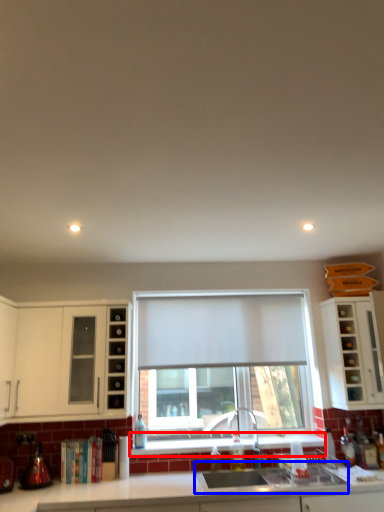
Question: Which point is further to the camera, window sill (highlighted by a red box) or sink (highlighted by a blue box)?

Choices:
 (A) window sill
 (B) sink

Answer: (A)